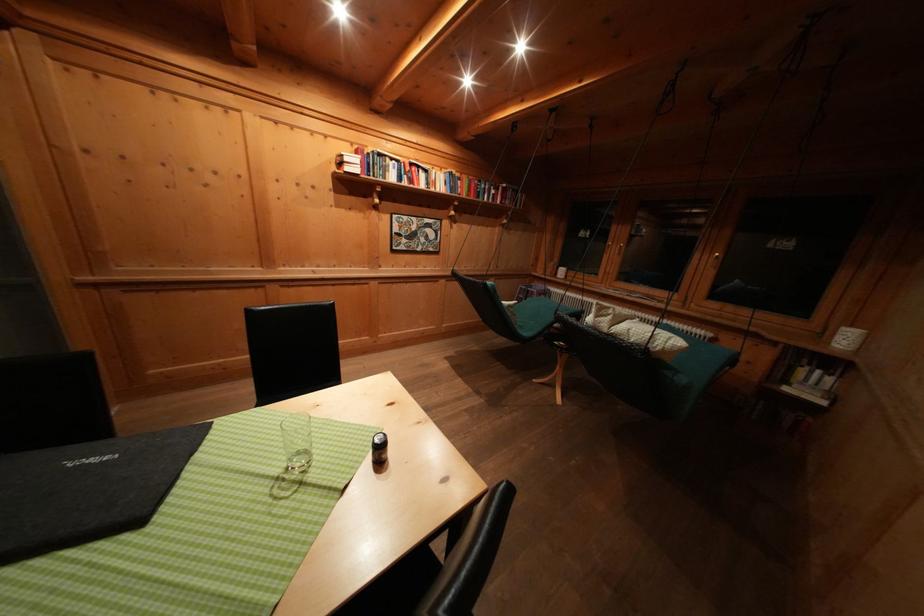
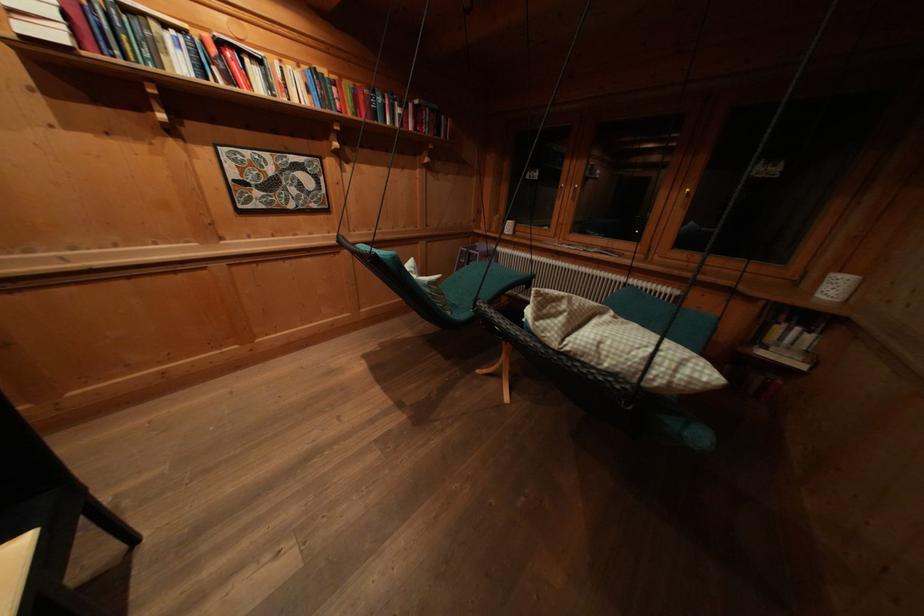
Find the pixel in the second image that matches point 615,322 in the first image.

(567, 323)